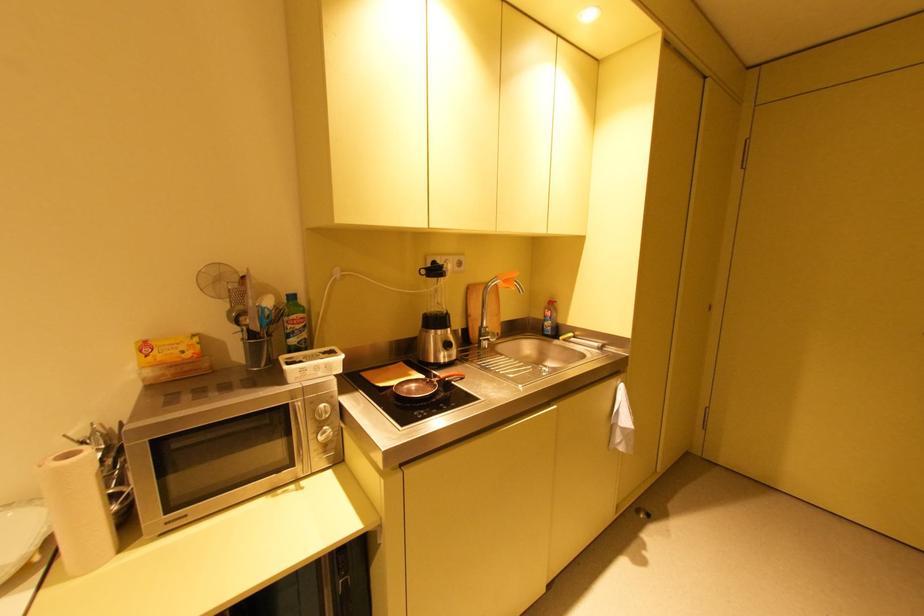
The image size is (924, 616). Identify the location of orange faucet handle. (507, 281).